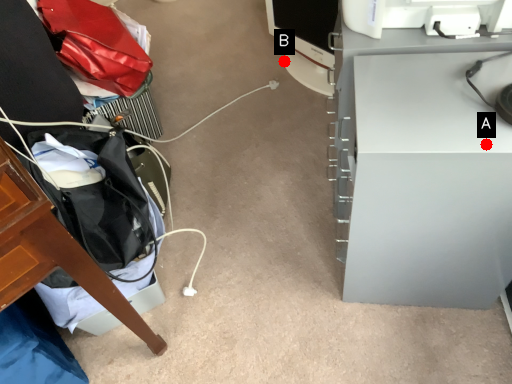
Question: Two points are circled on the image, labeled by A and B beside each circle. Among these points, which one is nearest to the camera?

Choices:
 (A) A is closer
 (B) B is closer

Answer: (A)